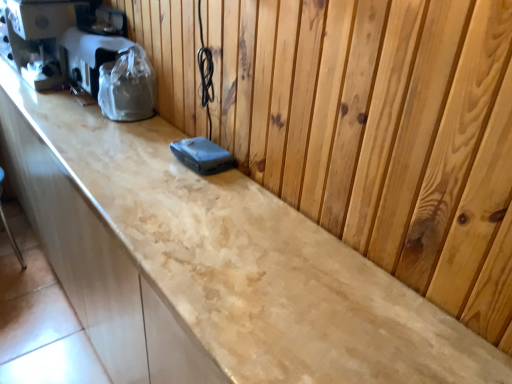
At what (x,y) coordinates should I click in order to perform the action: click on vacant area that is in front of matte black coffee machine at left. Please return your answer as a coordinate pair (x, y). Image resolution: width=512 pixels, height=384 pixels. Looking at the image, I should click on (46, 102).